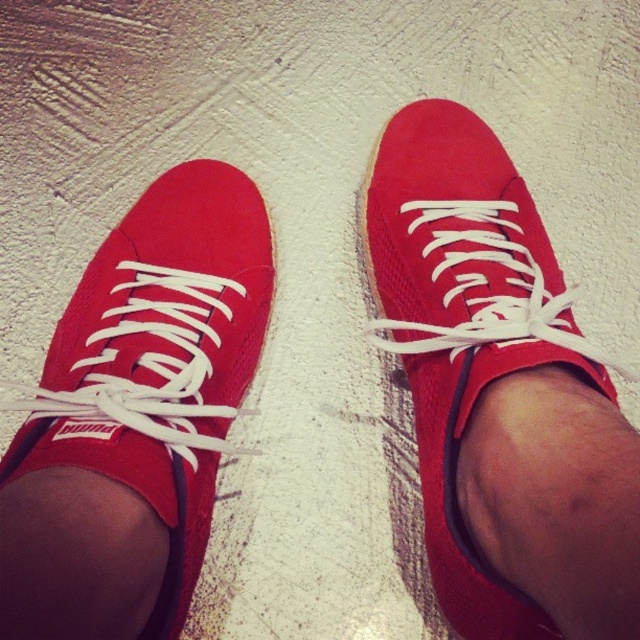
Consider the image. Is matte red sneaker at center positioned in front of suede/red shoe at center?

Yes, it is.

Measure the distance between matte red sneaker at center and suede/red shoe at center.

matte red sneaker at center and suede/red shoe at center are 10.25 inches apart from each other.

The image size is (640, 640). What do you see at coordinates (136, 416) in the screenshot? I see `matte red sneaker at center` at bounding box center [136, 416].

Find the location of a particular element. The height and width of the screenshot is (640, 640). matte red sneaker at center is located at coordinates (136, 416).